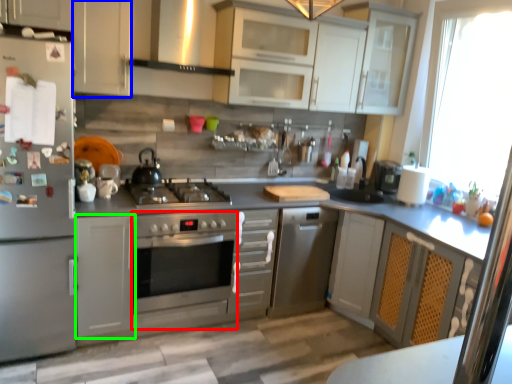
Question: Based on their relative distances, which object is farther from oven (highlighted by a red box)? Choose from cabinetry (highlighted by a blue box) and cabinetry (highlighted by a green box).

Choices:
 (A) cabinetry
 (B) cabinetry

Answer: (A)